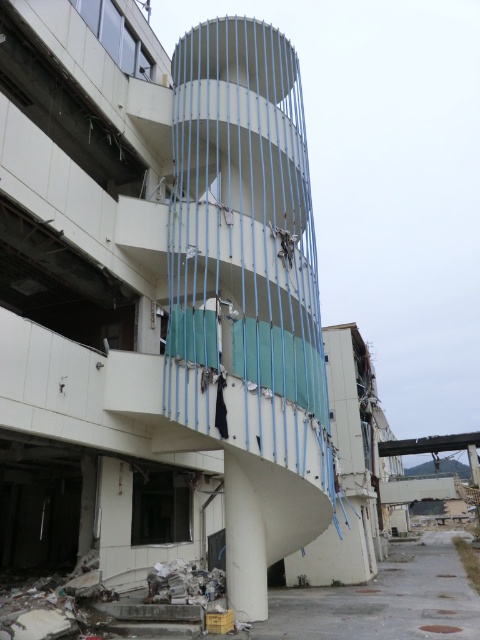
Can you confirm if white plastic scaffolding at center is taller than broken concrete rubble at lower center?

Correct, white plastic scaffolding at center is much taller as broken concrete rubble at lower center.

Can you confirm if white plastic scaffolding at center is shorter than broken concrete rubble at lower center?

In fact, white plastic scaffolding at center may be taller than broken concrete rubble at lower center.

In order to click on white plastic scaffolding at center in this screenshot , I will do `click(244, 250)`.

You are a GUI agent. You are given a task and a screenshot of the screen. Output one action in this format:
    pyautogui.click(x=<x>, y=<y>)
    Task: Click on the white plastic scaffolding at center
    The width and height of the screenshot is (480, 640).
    Given the screenshot: What is the action you would take?
    pyautogui.click(x=244, y=250)